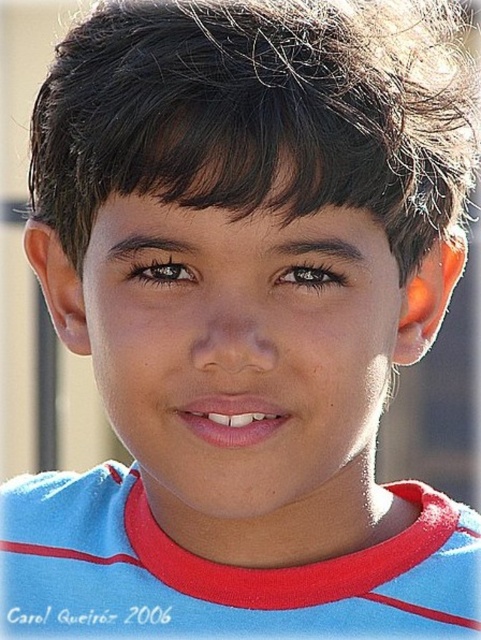
Can you confirm if dark brown shiny hair at center is positioned to the left of blue fabric shirt at center?

In fact, dark brown shiny hair at center is to the right of blue fabric shirt at center.

Between point (440, 180) and point (3, 577), which one is positioned in front?

Point (440, 180) is more forward.

Where is `dark brown shiny hair at center`? The image size is (481, 640). dark brown shiny hair at center is located at coordinates (260, 115).

Where is `dark brown shiny hair at center`? The image size is (481, 640). dark brown shiny hair at center is located at coordinates (260, 115).

Which is below, dark brown shiny hair at center or smooth skin face at center?

smooth skin face at center is lower down.

Is point (425, 230) closer to camera compared to point (159, 349)?

No, (425, 230) is further to viewer.

This screenshot has width=481, height=640. I want to click on dark brown shiny hair at center, so click(x=260, y=115).

Who is positioned more to the right, smooth skin face at center or blue fabric shirt at center?

Positioned to the right is smooth skin face at center.

In order to click on smooth skin face at center in this screenshot , I will do `click(240, 349)`.